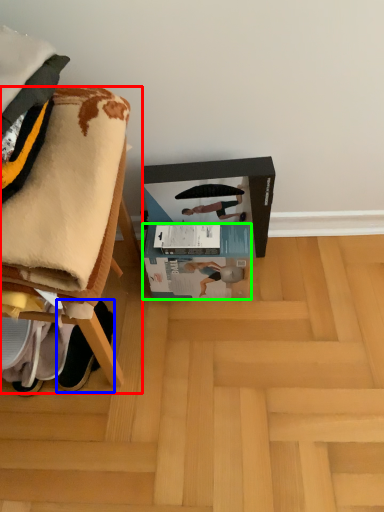
Question: Considering the real-world distances, which object is closest to furniture (highlighted by a red box)? footwear (highlighted by a blue box) or box (highlighted by a green box).

Choices:
 (A) footwear
 (B) box

Answer: (A)